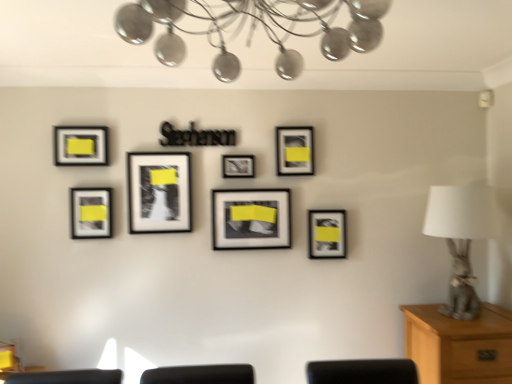
This screenshot has width=512, height=384. What do you see at coordinates (326, 234) in the screenshot?
I see `matte black picture frame at lower right, the first picture frame in the right-to-left sequence` at bounding box center [326, 234].

What do you see at coordinates (90, 213) in the screenshot?
I see `matte black picture frame at lower left, which ranks as the second picture frame in left-to-right order` at bounding box center [90, 213].

This screenshot has width=512, height=384. I want to click on matte black picture frame at center, placed as the 4th picture frame when sorted from right to left, so click(x=238, y=166).

The height and width of the screenshot is (384, 512). What do you see at coordinates (81, 146) in the screenshot?
I see `matte black picture frame at upper left, which is the 7th picture frame in right-to-left order` at bounding box center [81, 146].

Where is `matte black picture frame at upper left, which is the first picture frame from left to right`? matte black picture frame at upper left, which is the first picture frame from left to right is located at coordinates [x=81, y=146].

In order to face white fabric lampshade at right, should I rotate leftwards or rightwards?

To face it directly, rotate right by 26.099 degrees.

The width and height of the screenshot is (512, 384). In order to click on matte black picture frame at lower right, the first picture frame in the right-to-left sequence in this screenshot , I will do `click(326, 234)`.

Between matte black picture frame at upper center, the sixth picture frame from the left, and matte black picture frame at lower right, the seventh picture frame viewed from the left, which one has larger size?

Bigger between the two is matte black picture frame at upper center, the sixth picture frame from the left.

In the scene shown: Is matte black picture frame at upper center, the sixth picture frame from the left, positioned with its back to matte black picture frame at lower right, the seventh picture frame viewed from the left?

matte black picture frame at upper center, the sixth picture frame from the left, does not have its back to matte black picture frame at lower right, the seventh picture frame viewed from the left.

Consider the image. Considering the relative positions of matte black picture frame at upper center, which appears as the second picture frame when viewed from the right, and matte black picture frame at lower right, the seventh picture frame viewed from the left, in the image provided, is matte black picture frame at upper center, which appears as the second picture frame when viewed from the right, to the left of matte black picture frame at lower right, the seventh picture frame viewed from the left, from the viewer's perspective?

Yes.

Between matte black picture frame at upper center, the sixth picture frame from the left, and matte black picture frame at lower right, the first picture frame in the right-to-left sequence, which one is positioned behind?

matte black picture frame at lower right, the first picture frame in the right-to-left sequence.

Is metallic chandelier at upper center oriented away from white fabric lampshade at right?

No, metallic chandelier at upper center is not facing the opposite direction of white fabric lampshade at right.

In the scene shown: Is white fabric lampshade at right located within metallic chandelier at upper center?

No, white fabric lampshade at right is located outside of metallic chandelier at upper center.

Measure the distance between matte black picture frame at upper left, which is the first picture frame from left to right, and light brown wooden cabinet at lower right.

matte black picture frame at upper left, which is the first picture frame from left to right, is 1.93 meters from light brown wooden cabinet at lower right.

Is matte black picture frame at upper left, which is the 7th picture frame in right-to-left order, wider or thinner than light brown wooden cabinet at lower right?

Clearly, matte black picture frame at upper left, which is the 7th picture frame in right-to-left order, has less width compared to light brown wooden cabinet at lower right.

Considering the points (74, 144) and (412, 336), which point is behind, point (74, 144) or point (412, 336)?

Point (74, 144)

Who is bigger, matte black picture frame at upper left, which is the 7th picture frame in right-to-left order, or light brown wooden cabinet at lower right?

light brown wooden cabinet at lower right.

Is matte black picture frame at center, placed as the 4th picture frame when sorted from right to left, turned away from white fabric lampshade at right?

No.

Is matte black picture frame at center, placed as the 4th picture frame when sorted from right to left, completely or partially outside of white fabric lampshade at right?

matte black picture frame at center, placed as the 4th picture frame when sorted from right to left, is positioned outside white fabric lampshade at right.

In the scene shown: Is matte black picture frame at center, marked as the fourth picture frame in a left-to-right arrangement, smaller than white fabric lampshade at right?

Indeed, matte black picture frame at center, marked as the fourth picture frame in a left-to-right arrangement, has a smaller size compared to white fabric lampshade at right.

From a real-world perspective, is matte black picture frame at center, placed as the 4th picture frame when sorted from right to left, under white fabric lampshade at right?

Incorrect, from a real-world perspective, matte black picture frame at center, placed as the 4th picture frame when sorted from right to left, is higher than white fabric lampshade at right.

From a real-world perspective, which is physically below, matte black picture frame at upper left, which is the first picture frame from left to right, or matte black picture frame at center, the 5th picture frame from the right?

matte black picture frame at center, the 5th picture frame from the right.

The width and height of the screenshot is (512, 384). I want to click on picture frame that is the 3rd object located below the matte black picture frame at upper left, which is the first picture frame from left to right (from the image's perspective), so click(x=159, y=192).

Would you say matte black picture frame at center, the 5th picture frame from the right, is part of matte black picture frame at upper left, which is the 7th picture frame in right-to-left order,'s contents?

No, matte black picture frame at center, the 5th picture frame from the right, is not inside matte black picture frame at upper left, which is the 7th picture frame in right-to-left order.

Which of these two, matte black picture frame at upper left, which is the 7th picture frame in right-to-left order, or matte black picture frame at center, acting as the third picture frame starting from the left, is smaller?

Smaller between the two is matte black picture frame at upper left, which is the 7th picture frame in right-to-left order.

Is point (281, 66) farther from camera compared to point (267, 227)?

That is False.

Which object is further away from the camera, metallic chandelier at upper center or matte black picture frame at center, the fifth picture frame in the left-to-right sequence?

matte black picture frame at center, the fifth picture frame in the left-to-right sequence, is more distant.

There is a metallic chandelier at upper center. What are the coordinates of `the 6th picture frame below it (from a real-world perspective)` in the screenshot? It's located at (251, 219).

Considering the relative positions of metallic chandelier at upper center and matte black picture frame at center, the fifth picture frame in the left-to-right sequence, in the image provided, is metallic chandelier at upper center to the right of matte black picture frame at center, the fifth picture frame in the left-to-right sequence, from the viewer's perspective?

Indeed, metallic chandelier at upper center is positioned on the right side of matte black picture frame at center, the fifth picture frame in the left-to-right sequence.

In the scene shown: Would you say light brown wooden cabinet at lower right is part of metallic chandelier at upper center's contents?

No, light brown wooden cabinet at lower right is not inside metallic chandelier at upper center.

Does metallic chandelier at upper center appear on the left side of light brown wooden cabinet at lower right?

Correct, you'll find metallic chandelier at upper center to the left of light brown wooden cabinet at lower right.

From the image's perspective, is metallic chandelier at upper center below light brown wooden cabinet at lower right?

No, from the image's perspective, metallic chandelier at upper center is not below light brown wooden cabinet at lower right.

In the image, is metallic chandelier at upper center positioned in front of or behind light brown wooden cabinet at lower right?

Clearly, metallic chandelier at upper center is in front of light brown wooden cabinet at lower right.

The height and width of the screenshot is (384, 512). I want to click on picture frame lying behind the matte black picture frame at upper center, the sixth picture frame from the left, so click(x=326, y=234).

You are a GUI agent. You are given a task and a screenshot of the screen. Output one action in this format:
    pyautogui.click(x=<x>, y=<y>)
    Task: Click on the lamp that is on the left side of white fabric lampshade at right
    This screenshot has width=512, height=384.
    Given the screenshot: What is the action you would take?
    pyautogui.click(x=254, y=29)

Based on their spatial positions, is matte black picture frame at lower right, the seventh picture frame viewed from the left, or matte black picture frame at upper left, which is the first picture frame from left to right, closer to matte black picture frame at upper center, which appears as the second picture frame when viewed from the right?

matte black picture frame at lower right, the seventh picture frame viewed from the left.

Which object lies nearer to the anchor point matte black picture frame at lower right, the seventh picture frame viewed from the left, light brown wooden cabinet at lower right or matte black picture frame at upper left, which is the 7th picture frame in right-to-left order?

light brown wooden cabinet at lower right is positioned closer to the anchor matte black picture frame at lower right, the seventh picture frame viewed from the left.

From the image, which object appears to be farther from matte black picture frame at lower right, the seventh picture frame viewed from the left, matte black picture frame at center, the 3th picture frame from the right, or matte black picture frame at upper left, which is the 7th picture frame in right-to-left order?

The object further to matte black picture frame at lower right, the seventh picture frame viewed from the left, is matte black picture frame at upper left, which is the 7th picture frame in right-to-left order.

Based on their spatial positions, is matte black picture frame at lower left, which ranks as the second picture frame in left-to-right order, or matte black picture frame at upper left, which is the 7th picture frame in right-to-left order, closer to matte black picture frame at center, acting as the third picture frame starting from the left?

matte black picture frame at lower left, which ranks as the second picture frame in left-to-right order, is positioned closer to the anchor matte black picture frame at center, acting as the third picture frame starting from the left.

Considering their positions, is light brown wooden cabinet at lower right positioned closer to white fabric lampshade at right than matte black picture frame at center, the 3th picture frame from the right?

light brown wooden cabinet at lower right is closer to white fabric lampshade at right.

Based on their spatial positions, is matte black picture frame at center, the fifth picture frame in the left-to-right sequence, or metallic chandelier at upper center closer to white fabric lampshade at right?

matte black picture frame at center, the fifth picture frame in the left-to-right sequence, is positioned closer to the anchor white fabric lampshade at right.

From the image, which object appears to be nearer to matte black picture frame at upper left, which is the first picture frame from left to right, matte black picture frame at lower left, which appears as the 6th picture frame when viewed from the right, or matte black picture frame at upper center, which appears as the second picture frame when viewed from the right?

Based on the image, matte black picture frame at lower left, which appears as the 6th picture frame when viewed from the right, appears to be nearer to matte black picture frame at upper left, which is the first picture frame from left to right.

Looking at the image, which one is located closer to matte black picture frame at center, marked as the fourth picture frame in a left-to-right arrangement, matte black picture frame at center, acting as the third picture frame starting from the left, or matte black picture frame at upper left, which is the 7th picture frame in right-to-left order?

Among the two, matte black picture frame at center, acting as the third picture frame starting from the left, is located nearer to matte black picture frame at center, marked as the fourth picture frame in a left-to-right arrangement.

What are the coordinates of `table lamp located between matte black picture frame at upper left, which is the 7th picture frame in right-to-left order, and light brown wooden cabinet at lower right in the left-right direction` in the screenshot? It's located at (461, 238).

Locate an element on the screen. table lamp between matte black picture frame at upper center, the sixth picture frame from the left, and light brown wooden cabinet at lower right vertically is located at coordinates (461, 238).

This screenshot has width=512, height=384. Identify the location of table lamp between metallic chandelier at upper center and matte black picture frame at center, the 3th picture frame from the right, along the z-axis. (461, 238).

This screenshot has width=512, height=384. Identify the location of table located between metallic chandelier at upper center and matte black picture frame at center, placed as the 4th picture frame when sorted from right to left, in the depth direction. (459, 345).